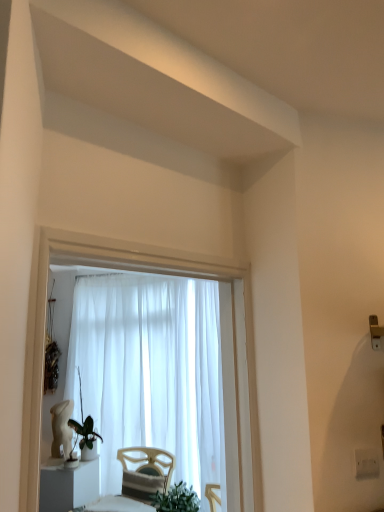
Question: Should I look upward or downward to see green matte plant at lower left?

Choices:
 (A) up
 (B) down

Answer: (B)

Question: From a real-world perspective, is white glossy statue at lower left beneath white plastic electric outlet at lower right?

Choices:
 (A) no
 (B) yes

Answer: (B)

Question: From the image's perspective, is white glossy statue at lower left on top of white plastic electric outlet at lower right?

Choices:
 (A) yes
 (B) no

Answer: (B)

Question: Does white glossy statue at lower left come behind white plastic electric outlet at lower right?

Choices:
 (A) no
 (B) yes

Answer: (B)

Question: Can you confirm if white glossy statue at lower left is thinner than white plastic electric outlet at lower right?

Choices:
 (A) yes
 (B) no

Answer: (B)

Question: Is white glossy statue at lower left smaller than white plastic electric outlet at lower right?

Choices:
 (A) yes
 (B) no

Answer: (B)

Question: Does white glossy statue at lower left have a lesser height compared to white plastic electric outlet at lower right?

Choices:
 (A) yes
 (B) no

Answer: (B)

Question: Does green matte plant at lower left have a greater height compared to white plastic electric outlet at lower right?

Choices:
 (A) no
 (B) yes

Answer: (B)

Question: Is green matte plant at lower left bigger than white plastic electric outlet at lower right?

Choices:
 (A) no
 (B) yes

Answer: (B)

Question: Is green matte plant at lower left turned away from white plastic electric outlet at lower right?

Choices:
 (A) no
 (B) yes

Answer: (A)

Question: From the image's perspective, is green matte plant at lower left located above white plastic electric outlet at lower right?

Choices:
 (A) no
 (B) yes

Answer: (A)

Question: Considering the relative positions of green matte plant at lower left and white plastic electric outlet at lower right in the image provided, is green matte plant at lower left to the right of white plastic electric outlet at lower right from the viewer's perspective?

Choices:
 (A) no
 (B) yes

Answer: (A)

Question: Can you confirm if green matte plant at lower left is shorter than white plastic electric outlet at lower right?

Choices:
 (A) no
 (B) yes

Answer: (A)

Question: Are green matte plant at lower left and white glossy statue at lower left far apart?

Choices:
 (A) yes
 (B) no

Answer: (B)